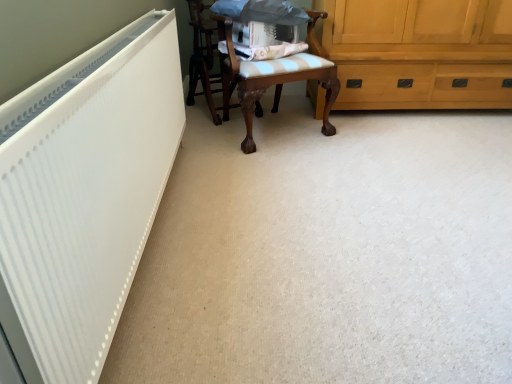
Question: Is white matte radiator at left beside wooden chair with cushion at center, which is the second chair from right to left?

Choices:
 (A) yes
 (B) no

Answer: (B)

Question: Could you tell me if white matte radiator at left is turned towards wooden chair with cushion at center, which is the second chair from right to left?

Choices:
 (A) yes
 (B) no

Answer: (B)

Question: Is white matte radiator at left outside wooden chair with cushion at center, which is the second chair from right to left?

Choices:
 (A) no
 (B) yes

Answer: (B)

Question: From a real-world perspective, does white matte radiator at left stand above wooden chair with cushion at center, the first chair viewed from the left?

Choices:
 (A) yes
 (B) no

Answer: (A)

Question: From the image's perspective, is white matte radiator at left on wooden chair with cushion at center, which is the second chair from right to left?

Choices:
 (A) yes
 (B) no

Answer: (B)

Question: From a real-world perspective, is wooden chair with cushion at center, the first chair viewed from the left, physically located above or below white matte radiator at left?

Choices:
 (A) below
 (B) above

Answer: (A)

Question: In the image, is wooden chair with cushion at center, the first chair viewed from the left, on the left side or the right side of white matte radiator at left?

Choices:
 (A) right
 (B) left

Answer: (A)

Question: In terms of height, does wooden chair with cushion at center, which is the second chair from right to left, look taller or shorter compared to white matte radiator at left?

Choices:
 (A) short
 (B) tall

Answer: (B)

Question: From the image's perspective, is wooden chair with cushion at center, which is the second chair from right to left, located above or below white matte radiator at left?

Choices:
 (A) below
 (B) above

Answer: (B)

Question: Do you think wooden chair with striped cushion at center, which is the 2th chair in left-to-right order, is within wooden chair with cushion at center, the first chair viewed from the left, or outside of it?

Choices:
 (A) inside
 (B) outside

Answer: (B)

Question: From the image's perspective, is wooden chair with striped cushion at center, which is the 2th chair in left-to-right order, located above or below wooden chair with cushion at center, the first chair viewed from the left?

Choices:
 (A) below
 (B) above

Answer: (A)

Question: Is wooden chair with striped cushion at center, which is the 2th chair in left-to-right order, wider or thinner than wooden chair with cushion at center, the first chair viewed from the left?

Choices:
 (A) wide
 (B) thin

Answer: (A)

Question: Is wooden chair with striped cushion at center, the 1th chair positioned from the right, taller or shorter than wooden chair with cushion at center, the first chair viewed from the left?

Choices:
 (A) tall
 (B) short

Answer: (A)

Question: Is wooden chair with cushion at center, the first chair viewed from the left, taller or shorter than wooden chair with striped cushion at center, which is the 2th chair in left-to-right order?

Choices:
 (A) tall
 (B) short

Answer: (B)

Question: From the image's perspective, is wooden chair with cushion at center, which is the second chair from right to left, above or below wooden chair with striped cushion at center, the 1th chair positioned from the right?

Choices:
 (A) above
 (B) below

Answer: (A)